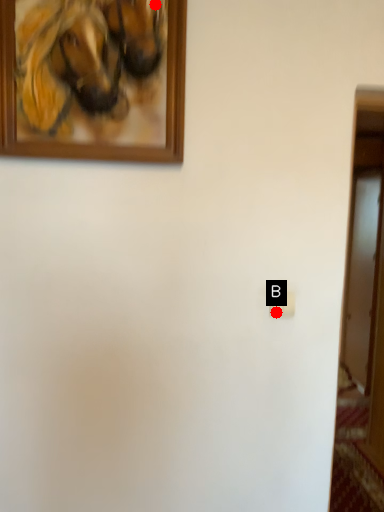
Question: Two points are circled on the image, labeled by A and B beside each circle. Which point is closer to the camera taking this photo?

Choices:
 (A) A is closer
 (B) B is closer

Answer: (A)